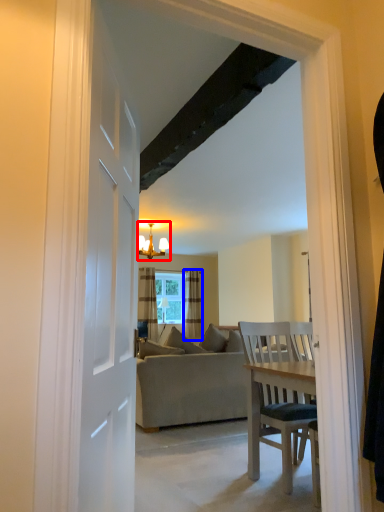
Question: Which object is closer to the camera taking this photo, light fixture (highlighted by a red box) or curtain (highlighted by a blue box)?

Choices:
 (A) light fixture
 (B) curtain

Answer: (A)